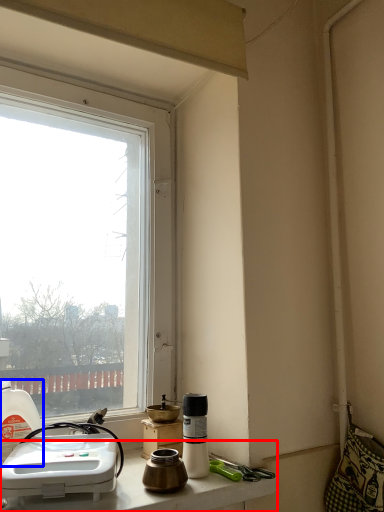
Question: Which point is further to the camera, counter top (highlighted by a red box) or bottle (highlighted by a blue box)?

Choices:
 (A) counter top
 (B) bottle

Answer: (B)